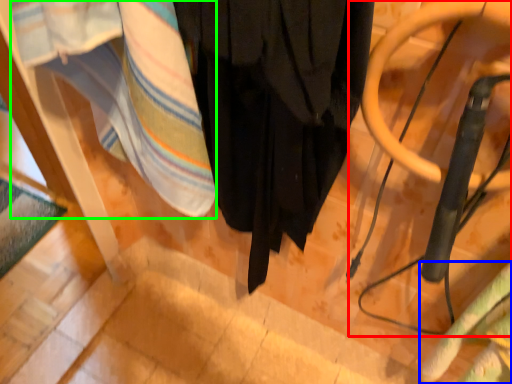
Question: Which object is the closest to the swivel chair (highlighted by a red box)? Choose among these: blanket (highlighted by a blue box) or blanket (highlighted by a green box).

Choices:
 (A) blanket
 (B) blanket

Answer: (A)